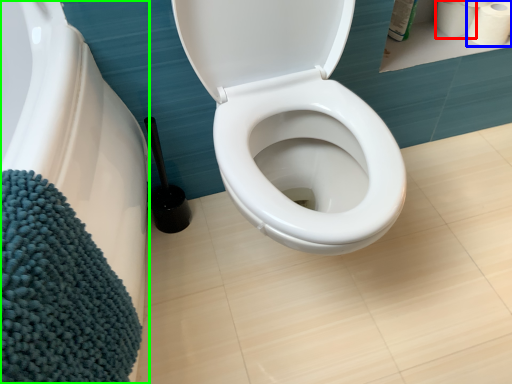
Question: Which object is the farthest from toilet paper (highlighted by a red box)? Choose among these: toilet paper (highlighted by a blue box) or bath (highlighted by a green box).

Choices:
 (A) toilet paper
 (B) bath

Answer: (B)